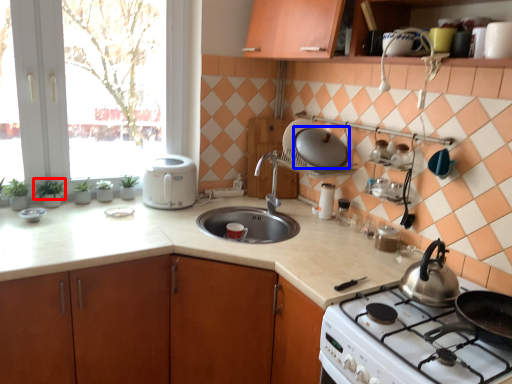
Question: Which of the following is the farthest to the observer, plant (highlighted by a red box) or kitchen appliance (highlighted by a blue box)?

Choices:
 (A) plant
 (B) kitchen appliance

Answer: (A)